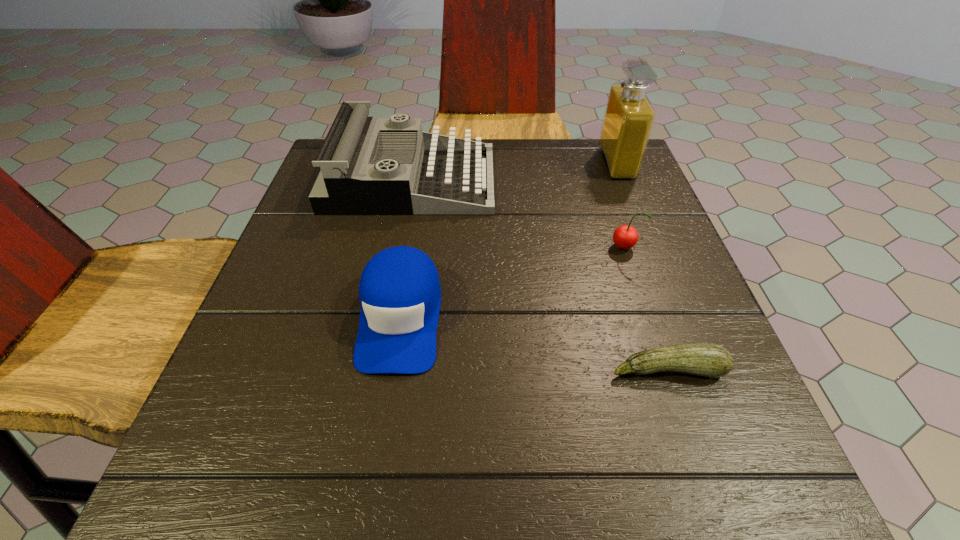
Where is `perfume`? The image size is (960, 540). perfume is located at coordinates (629, 116).

At what (x,y) coordinates should I click in order to perform the action: click on typewriter. Please return your answer as a coordinate pair (x, y). Looking at the image, I should click on (369, 165).

You are a GUI agent. You are given a task and a screenshot of the screen. Output one action in this format:
    pyautogui.click(x=<x>, y=<y>)
    Task: Click on the third nearest object
    
    Given the screenshot: What is the action you would take?
    pyautogui.click(x=625, y=237)

The width and height of the screenshot is (960, 540). I want to click on baseball cap, so click(399, 291).

Find the location of a particular element. The height and width of the screenshot is (540, 960). the shortest object is located at coordinates (704, 359).

Image resolution: width=960 pixels, height=540 pixels. Identify the location of blank area located 0.110m on the front-facing side of the perfume. (559, 163).

The width and height of the screenshot is (960, 540). Identify the location of vacant space located 0.370m on the front-facing side of the perfume. (453, 163).

Where is `vacant space located 0.120m on the front-facing side of the perfume`? This screenshot has height=540, width=960. vacant space located 0.120m on the front-facing side of the perfume is located at coordinates (554, 163).

Where is `vacant position located on the typing side of the typewriter`? This screenshot has height=540, width=960. vacant position located on the typing side of the typewriter is located at coordinates (612, 180).

The image size is (960, 540). Identify the location of vacant area situated on the left of the cherry. coord(505,248).